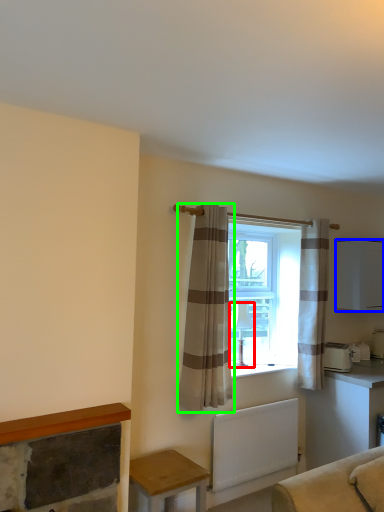
Question: Considering the real-world distances, which object is farthest from lamp (highlighted by a red box)? cabinetry (highlighted by a blue box) or curtain (highlighted by a green box)?

Choices:
 (A) cabinetry
 (B) curtain

Answer: (A)